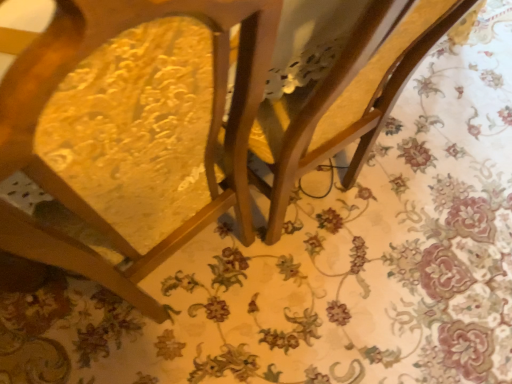
Question: Considering the relative positions of wooden swivel chair at center and wooden chair at center in the image provided, is wooden swivel chair at center to the right of wooden chair at center from the viewer's perspective?

Choices:
 (A) yes
 (B) no

Answer: (A)

Question: Is wooden swivel chair at center closer to camera compared to wooden chair at center?

Choices:
 (A) yes
 (B) no

Answer: (B)

Question: Considering the relative positions of wooden swivel chair at center and wooden chair at center in the image provided, is wooden swivel chair at center behind wooden chair at center?

Choices:
 (A) yes
 (B) no

Answer: (A)

Question: Does wooden swivel chair at center have a greater height compared to wooden chair at center?

Choices:
 (A) yes
 (B) no

Answer: (B)

Question: Considering the relative sizes of wooden swivel chair at center and wooden chair at center in the image provided, is wooden swivel chair at center thinner than wooden chair at center?

Choices:
 (A) yes
 (B) no

Answer: (A)

Question: Is wooden chair at center surrounded by wooden swivel chair at center?

Choices:
 (A) yes
 (B) no

Answer: (B)

Question: Is wooden chair at center not within wooden swivel chair at center?

Choices:
 (A) no
 (B) yes

Answer: (B)

Question: Is wooden chair at center aimed at wooden swivel chair at center?

Choices:
 (A) yes
 (B) no

Answer: (B)

Question: Is wooden chair at center at the left side of wooden swivel chair at center?

Choices:
 (A) yes
 (B) no

Answer: (A)

Question: Is wooden chair at center positioned behind wooden swivel chair at center?

Choices:
 (A) yes
 (B) no

Answer: (B)

Question: From a real-world perspective, does wooden chair at center sit lower than wooden swivel chair at center?

Choices:
 (A) yes
 (B) no

Answer: (B)

Question: Would you say wooden chair at center contains wooden swivel chair at center?

Choices:
 (A) yes
 (B) no

Answer: (B)

Question: In the image, is wooden swivel chair at center positioned in front of or behind wooden chair at center?

Choices:
 (A) front
 (B) behind

Answer: (B)